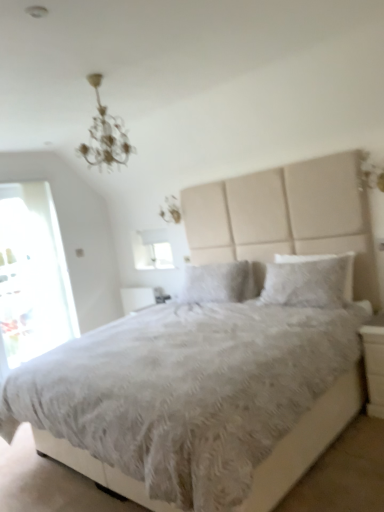
What do you see at coordinates (374, 364) in the screenshot? I see `white glossy nightstand at lower right` at bounding box center [374, 364].

What do you see at coordinates (309, 281) in the screenshot? This screenshot has width=384, height=512. I see `white fluffy pillow at center, which is counted as the second pillow, starting from the left` at bounding box center [309, 281].

Image resolution: width=384 pixels, height=512 pixels. In order to click on white glossy nightstand at lower right in this screenshot , I will do `click(374, 364)`.

Where is `bed that appears above the white glossy nightstand at lower right (from the image's perspective)`? This screenshot has height=512, width=384. bed that appears above the white glossy nightstand at lower right (from the image's perspective) is located at coordinates (82, 237).

From the image's perspective, which one is positioned lower, white fluffy bed at center or white glossy nightstand at lower right?

From the image's view, white glossy nightstand at lower right is below.

Does white fluffy bed at center have a lesser width compared to white glossy nightstand at lower right?

Incorrect, the width of white fluffy bed at center is not less than that of white glossy nightstand at lower right.

Does white fluffy bed at center turn towards white glossy nightstand at lower right?

No.

Which object is positioned more to the right, white glossy nightstand at lower right or metallic chandelier at upper center?

white glossy nightstand at lower right.

Based on the photo, from a real-world perspective, which object rests below the other?

white glossy nightstand at lower right, from a real-world perspective.

What's the angular difference between white glossy nightstand at lower right and metallic chandelier at upper center's facing directions?

90.9 degrees.

Is white glossy nightstand at lower right behind metallic chandelier at upper center?

Yes, white glossy nightstand at lower right is further from the viewer.

Looking at this image, from a real-world perspective, is transparent glass door at left on top of white fluffy pillow at center, which is counted as the second pillow, starting from the left?

Indeed, from a real-world perspective, transparent glass door at left stands above white fluffy pillow at center, which is counted as the second pillow, starting from the left.

Considering the relative positions of transparent glass door at left and white fluffy pillow at center, which is counted as the second pillow, starting from the left, in the image provided, is transparent glass door at left behind white fluffy pillow at center, which is counted as the second pillow, starting from the left,?

Yes, transparent glass door at left is further from the camera.

Image resolution: width=384 pixels, height=512 pixels. What are the coordinates of `pillow that is the 2nd object to the right of the transparent glass door at left, starting at the anchor` in the screenshot? It's located at (309, 281).

Looking at this image, which is more to the right, transparent glass door at left or white fluffy pillow at center, which is the 2th pillow from back to front?

Positioned to the right is white fluffy pillow at center, which is the 2th pillow from back to front.

Would you say white fluffy pillow at center, which ranks as the 1th pillow in front-to-back order, is to the left or to the right of fluffy white pillow at center, the 2th pillow viewed from the right, in the picture?

Based on their positions, white fluffy pillow at center, which ranks as the 1th pillow in front-to-back order, is located to the right of fluffy white pillow at center, the 2th pillow viewed from the right.

Locate an element on the screen. Image resolution: width=384 pixels, height=512 pixels. pillow located above the fluffy white pillow at center, the 2th pillow viewed from the right (from the image's perspective) is located at coordinates (309, 281).

Is white fluffy pillow at center, which is the 2th pillow from back to front, oriented away from fluffy white pillow at center, the first pillow from the back?

No, fluffy white pillow at center, the first pillow from the back, is not at the back of white fluffy pillow at center, which is the 2th pillow from back to front.

From the image's perspective, is white fluffy pillow at center, which is counted as the second pillow, starting from the left, beneath fluffy white pillow at center, the 2th pillow viewed from the right?

→ No, from the image's perspective, white fluffy pillow at center, which is counted as the second pillow, starting from the left, is not below fluffy white pillow at center, the 2th pillow viewed from the right.

Is white matte window screen at upper center not inside white fluffy pillow at center, which is counted as the second pillow, starting from the left?

Indeed, white matte window screen at upper center is completely outside white fluffy pillow at center, which is counted as the second pillow, starting from the left.

Consider the image. Is white matte window screen at upper center far from white fluffy pillow at center, which is counted as the second pillow, starting from the left?

Indeed, white matte window screen at upper center is not near white fluffy pillow at center, which is counted as the second pillow, starting from the left.

This screenshot has width=384, height=512. Find the location of `window screen that appears on the left of white fluffy pillow at center, arranged as the first pillow when viewed from the right`. window screen that appears on the left of white fluffy pillow at center, arranged as the first pillow when viewed from the right is located at coordinates (152, 250).

From the image's perspective, is white matte window screen at upper center above white fluffy pillow at center, which ranks as the 1th pillow in front-to-back order?

Indeed, from the image's perspective, white matte window screen at upper center is shown above white fluffy pillow at center, which ranks as the 1th pillow in front-to-back order.

Is metallic chandelier at upper center closer to camera compared to white matte window screen at upper center?

Yes, metallic chandelier at upper center is in front of white matte window screen at upper center.

In the scene shown: From the image's perspective, is metallic chandelier at upper center on white matte window screen at upper center?

Yes, from the image's perspective, metallic chandelier at upper center is over white matte window screen at upper center.

Considering the sizes of objects white fluffy bed at center and white matte window screen at upper center in the image provided, who is smaller, white fluffy bed at center or white matte window screen at upper center?

With smaller size is white matte window screen at upper center.

Which is correct: white fluffy bed at center is inside white matte window screen at upper center, or outside of it?

white fluffy bed at center is not enclosed by white matte window screen at upper center.

Which object is further away from the camera, white fluffy bed at center or white matte window screen at upper center?

white matte window screen at upper center.

You are a GUI agent. You are given a task and a screenshot of the screen. Output one action in this format:
    pyautogui.click(x=<x>, y=<y>)
    Task: Click on the nightstand on the right side of white fluffy bed at center
    
    Given the screenshot: What is the action you would take?
    pyautogui.click(x=374, y=364)

This screenshot has height=512, width=384. In the image, there is a white glossy nightstand at lower right. Find the location of `light fixture above it (from the image's perspective)`. light fixture above it (from the image's perspective) is located at coordinates (105, 135).

Considering their positions, is white fluffy pillow at center, which is counted as the second pillow, starting from the left, positioned closer to white fluffy bed at center than white glossy nightstand at lower right?

The object closer to white fluffy bed at center is white fluffy pillow at center, which is counted as the second pillow, starting from the left.

Which object lies further to the anchor point metallic chandelier at upper center, fluffy white pillow at center, the 2th pillow viewed from the right, or transparent glass door at left?

Based on the image, transparent glass door at left appears to be further to metallic chandelier at upper center.

When comparing their distances from fluffy white pillow at center, the 2th pillow viewed from the right, does white fluffy bed at center or metallic chandelier at upper center seem further?

metallic chandelier at upper center.

Which object lies further to the anchor point metallic chandelier at upper center, white matte window screen at upper center or white fluffy pillow at center, which is the 2th pillow from back to front?

Based on the image, white matte window screen at upper center appears to be further to metallic chandelier at upper center.

Looking at the image, which one is located closer to white fluffy bed at center, fluffy white pillow at center, the first pillow from the left, or transparent glass door at left?

transparent glass door at left.

Based on their spatial positions, is white glossy nightstand at lower right or white matte window screen at upper center further from white fluffy bed at center?

white glossy nightstand at lower right is further to white fluffy bed at center.

Consider the image. From the image, which object appears to be nearer to white glossy nightstand at lower right, transparent glass door at left or white fluffy bed at center?

white fluffy bed at center.

Considering their positions, is white fluffy bed at center positioned further to transparent glass door at left than white glossy nightstand at lower right?

white glossy nightstand at lower right lies further to transparent glass door at left than the other object.

Image resolution: width=384 pixels, height=512 pixels. Identify the location of pillow between metallic chandelier at upper center and white fluffy pillow at center, arranged as the first pillow when viewed from the right. (218, 283).

Image resolution: width=384 pixels, height=512 pixels. What are the coordinates of `light fixture between transparent glass door at left and white fluffy pillow at center, arranged as the first pillow when viewed from the right, in the horizontal direction` in the screenshot? It's located at (105, 135).

Where is `window screen between transparent glass door at left and white glossy nightstand at lower right in the horizontal direction`? window screen between transparent glass door at left and white glossy nightstand at lower right in the horizontal direction is located at coordinates (152, 250).

You are a GUI agent. You are given a task and a screenshot of the screen. Output one action in this format:
    pyautogui.click(x=<x>, y=<y>)
    Task: Click on the light fixture between white fluffy bed at center and fluffy white pillow at center, acting as the second pillow starting from the front, in the front-back direction
    Image resolution: width=384 pixels, height=512 pixels.
    Given the screenshot: What is the action you would take?
    pyautogui.click(x=105, y=135)